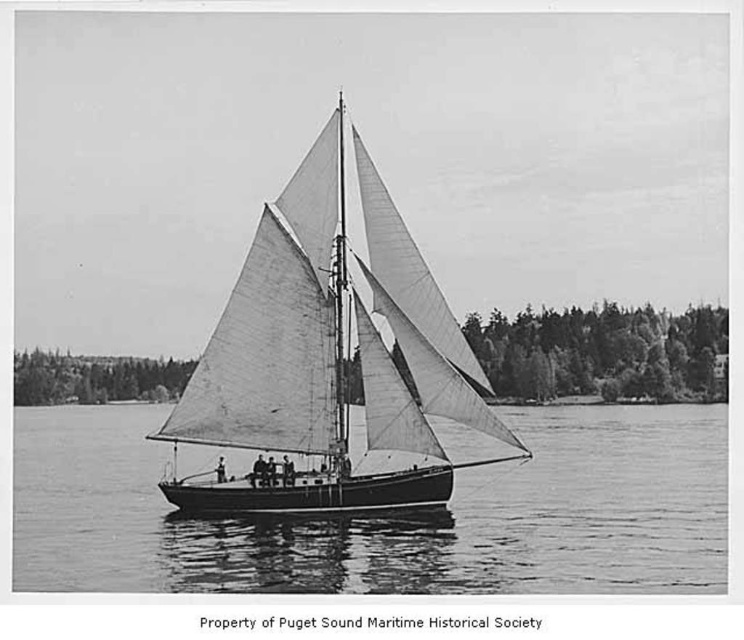
Question: Does smooth water at center appear on the left side of white canvas sail at center?

Choices:
 (A) yes
 (B) no

Answer: (B)

Question: Can you confirm if smooth water at center is smaller than white canvas sail at center?

Choices:
 (A) yes
 (B) no

Answer: (B)

Question: Which object is closer to the camera taking this photo?

Choices:
 (A) smooth water at center
 (B) white canvas sail at center

Answer: (A)

Question: Which point is closer to the camera?

Choices:
 (A) white canvas sail at center
 (B) smooth water at center

Answer: (B)

Question: Can you confirm if smooth water at center is bigger than white canvas sail at center?

Choices:
 (A) no
 (B) yes

Answer: (B)